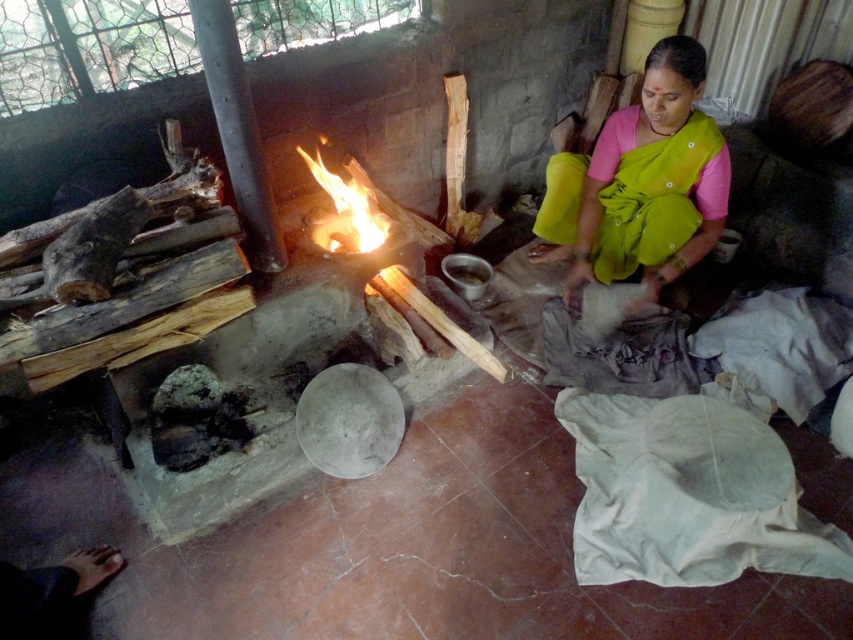
Question: Which point is farther from the camera taking this photo?

Choices:
 (A) (688, 54)
 (B) (355, 237)

Answer: (B)

Question: Is green fabric sari at center smaller than flamewoodfire at center?

Choices:
 (A) yes
 (B) no

Answer: (B)

Question: Observing the image, what is the correct spatial positioning of green fabric sari at center in reference to flamewoodfire at center?

Choices:
 (A) above
 (B) below

Answer: (A)

Question: Can you confirm if green fabric sari at center is wider than flamewoodfire at center?

Choices:
 (A) no
 (B) yes

Answer: (B)